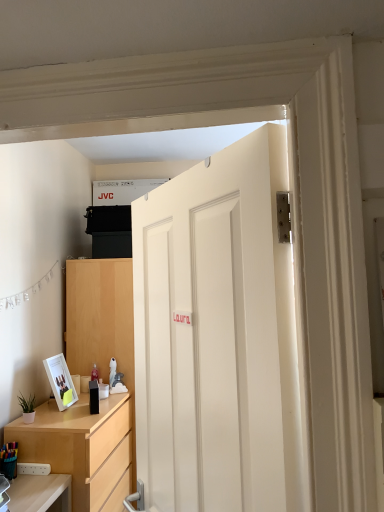
Image resolution: width=384 pixels, height=512 pixels. Identify the location of vacant space to the right of green matte plant at lower left. (48, 421).